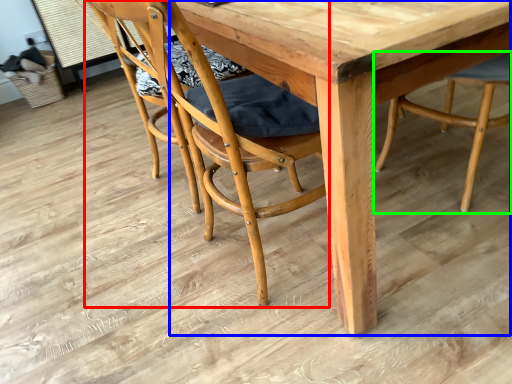
Question: Considering the real-world distances, which object is farthest from chair (highlighted by a red box)? round table (highlighted by a blue box) or chair (highlighted by a green box)?

Choices:
 (A) round table
 (B) chair

Answer: (B)